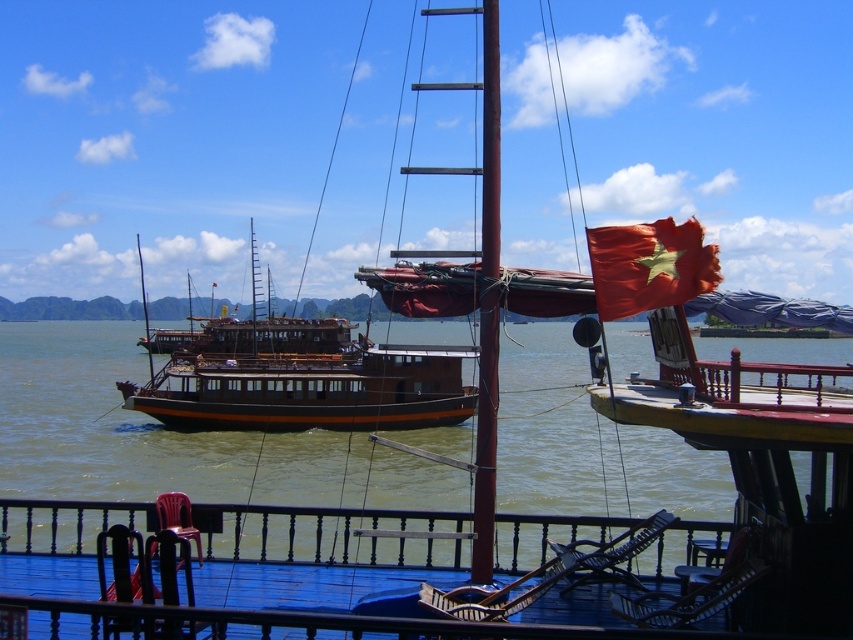
You are a sailor on the wooden boat with a dark blue deck and black railings. You need to navigate between the greenish water at center and the red matte flag at upper right. Which direction should you move towards to reach the flag first?

The greenish water at center is to the left of red matte flag at upper right, so you should move towards the right to reach the red matte flag at upper right first.

You are standing on the deck of the wooden boat with a dark blue deck and black railings. You want to move to the brown wooden boat at center. Which direction should you go?

The brown wooden boat at center is located at point (306, 381), so you should go towards the center of the image to reach it.

Consider the image. You are a sailor on the brown wooden boat at center. You want to reach the red matte flag at upper right to adjust it. Which direction should you move towards?

The brown wooden boat at center is positioned on the left side of red matte flag at upper right, so you should move towards the right to reach the red matte flag at upper right.